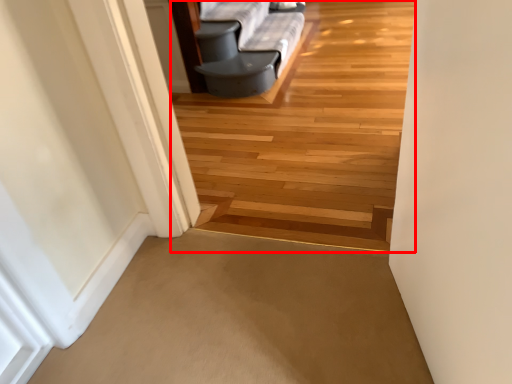
Question: From the image's perspective, where is path (annotated by the red box) located in relation to path in the image?

Choices:
 (A) below
 (B) above

Answer: (B)